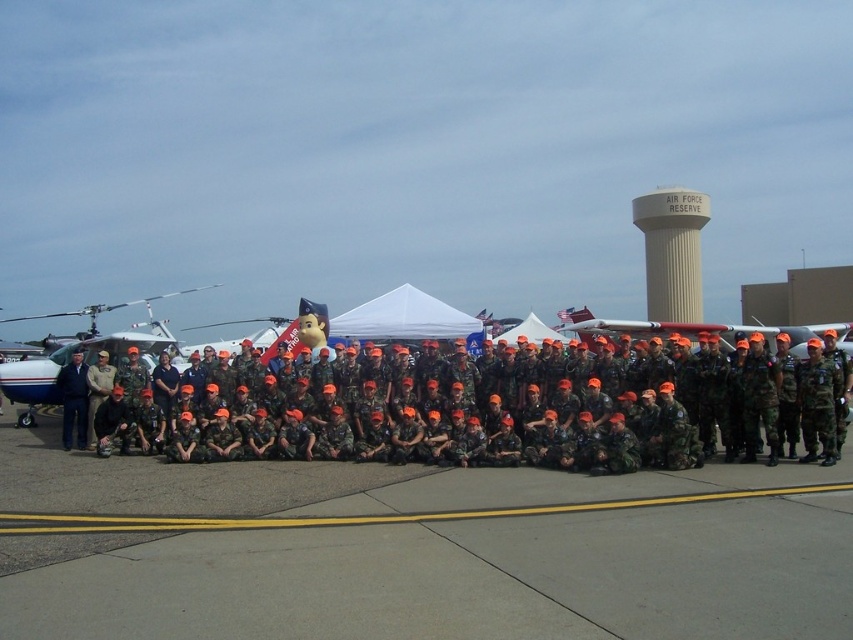
You are a photographer taking a group photo of the military personnel. You need to ensure that the gray asphalt tarmac at center and the camouflage uniform at center are both visible in the photo. Based on their positions, which object should appear lower in the photo?

The gray asphalt tarmac at center is located below the camouflage uniform at center, so in the photo, the gray asphalt tarmac at center will appear lower than the camouflage uniform at center.

You are a photographer taking a group photo of the camouflage uniform at center and the beige concrete water tower at upper center. Which object should you focus on first if you want to ensure both are in focus, considering their heights?

The camouflage uniform at center is shorter than the beige concrete water tower at upper center, so you should focus on the beige concrete water tower at upper center first to ensure both are in focus.

You are a photographer standing at the edge of the airfield, and you want to take a photo that includes both the camouflage uniform at center and the beige concrete water tower at upper center. Given that your camera has a maximum zoom range of 25 meters, can you capture both subjects in the same frame without moving your position?

The camouflage uniform at center is 31.03 meters away from the beige concrete water tower at upper center. Since the camera can only zoom up to 25 meters, it cannot capture both subjects in the same frame without moving your position.